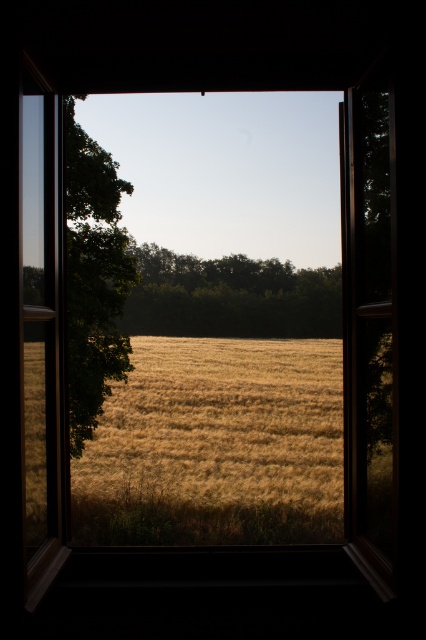
You are standing in a room looking through the open window. You notice two green leafy trees outside. Which tree, the green leafy tree at left or the green leafy tree at center, is taller?

The green leafy tree at center is taller than the green leafy tree at left.